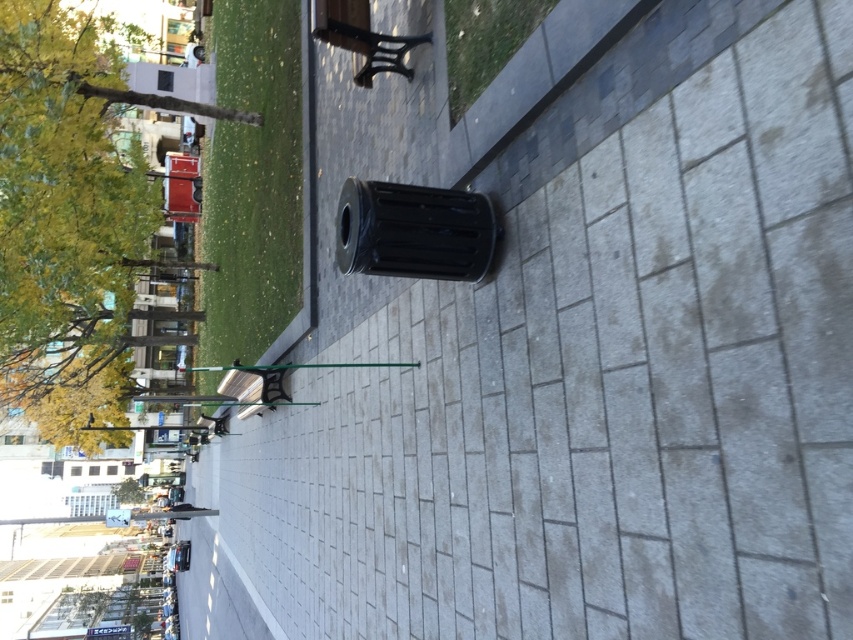
You are planning to install a new bench in the park. The park requires that benches must be placed between two trees of different sizes. Given the green leafy tree at upper left and the green leafy tree at lower left, can you place the bench between them?

Yes, the bench can be placed between the green leafy tree at upper left and the green leafy tree at lower left because the green leafy tree at upper left is larger than the green leafy tree at lower left, meeting the requirement of different sizes.

You are standing at the center of the walkway in the urban park and see the point marked at coordinates (x=68, y=220). What object does this point indicate?

The point at coordinates (x=68, y=220) marks the green leafy tree at upper left.